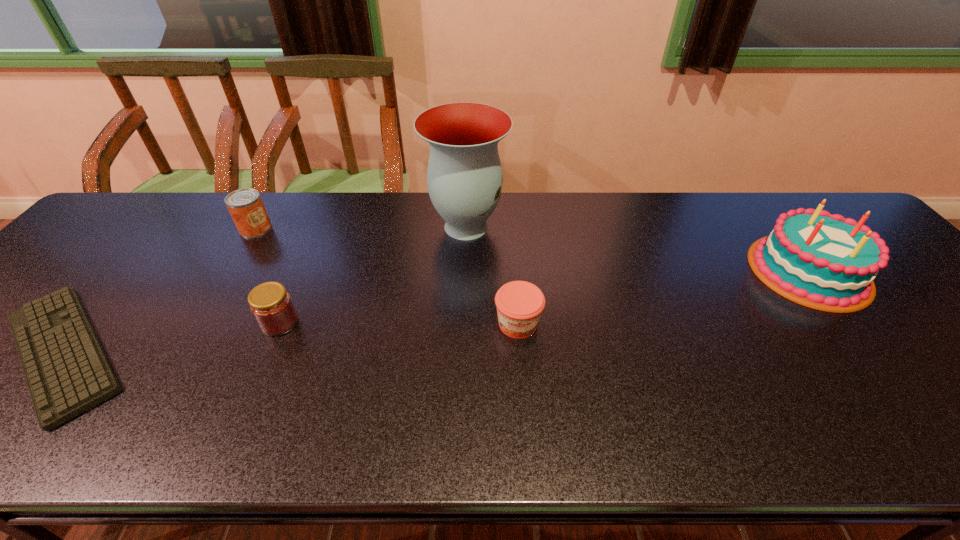
Where is `free space located on the front label of the right jam`? The width and height of the screenshot is (960, 540). free space located on the front label of the right jam is located at coordinates (526, 431).

At what (x,y) coordinates should I click in order to perform the action: click on vase located at the far edge. Please return your answer as a coordinate pair (x, y). Looking at the image, I should click on (464, 176).

Locate an element on the screen. The width and height of the screenshot is (960, 540). birthday cake that is at the far edge is located at coordinates (823, 261).

Identify the location of can that is at the far edge. The height and width of the screenshot is (540, 960). (245, 205).

Locate an element on the screen. object that is at the right edge is located at coordinates (823, 261).

Find the location of a particular element. The width and height of the screenshot is (960, 540). object situated at the far right corner is located at coordinates (823, 261).

The height and width of the screenshot is (540, 960). In the image, there is a desktop. Find the location of `free space at the far edge`. free space at the far edge is located at coordinates (398, 205).

The width and height of the screenshot is (960, 540). In the image, there is a desktop. What are the coordinates of `vacant space at the near edge` in the screenshot? It's located at (396, 422).

This screenshot has height=540, width=960. In the image, there is a desktop. Identify the location of free space at the far right corner. [790, 208].

Locate an element on the screen. The image size is (960, 540). free space between the birthday cake and the vase is located at coordinates [637, 248].